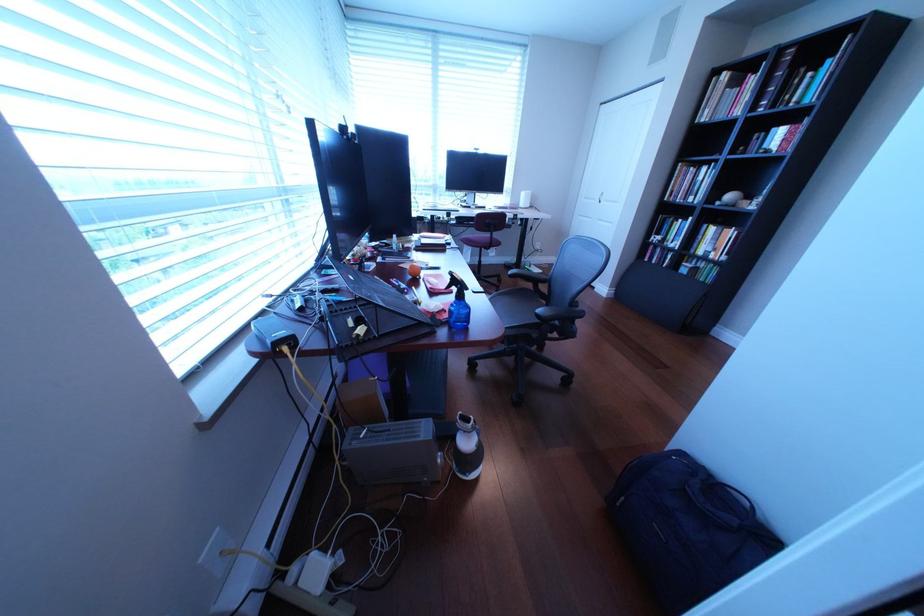
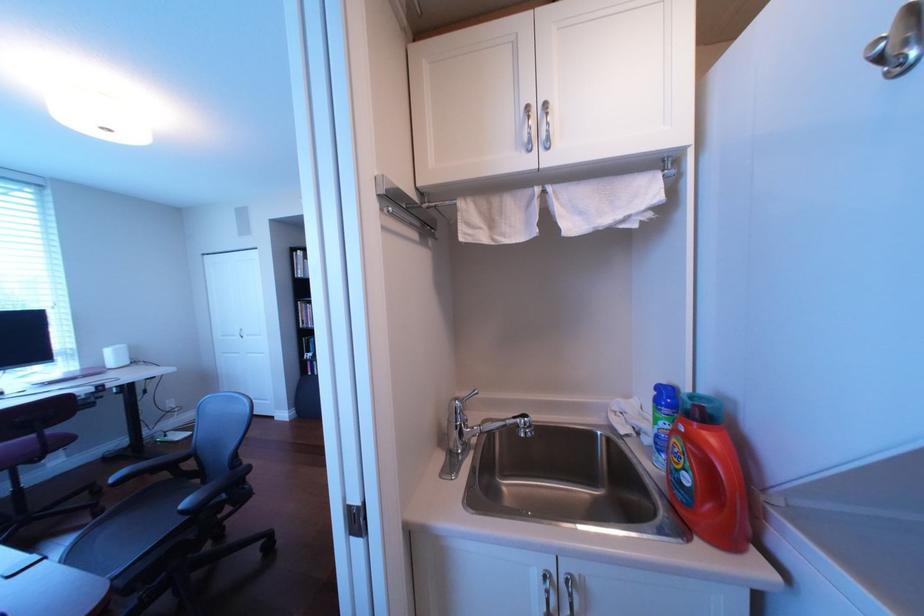
Question: Based on the continuous images, in which direction is the camera rotating? Reply with the corresponding letter.

Choices:
 (A) Left
 (B) Right
 (C) Up
 (D) Down

Answer: (B)